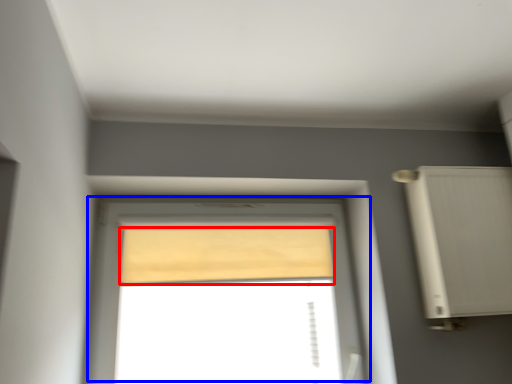
Question: Among these objects, which one is nearest to the camera, curtain (highlighted by a red box) or window (highlighted by a blue box)?

Choices:
 (A) curtain
 (B) window

Answer: (B)